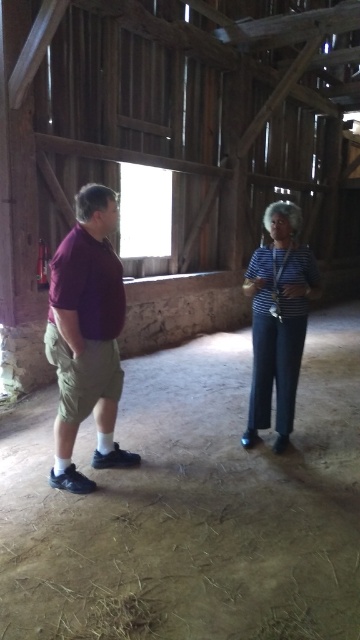
You are standing inside the rustic barn and see two shirts at the left side. Which shirt is closer to you, the maroon fabric shirt at left or the matte purple shirt at left?

The maroon fabric shirt at left is closer to you since it is further to the viewer than the matte purple shirt at left.